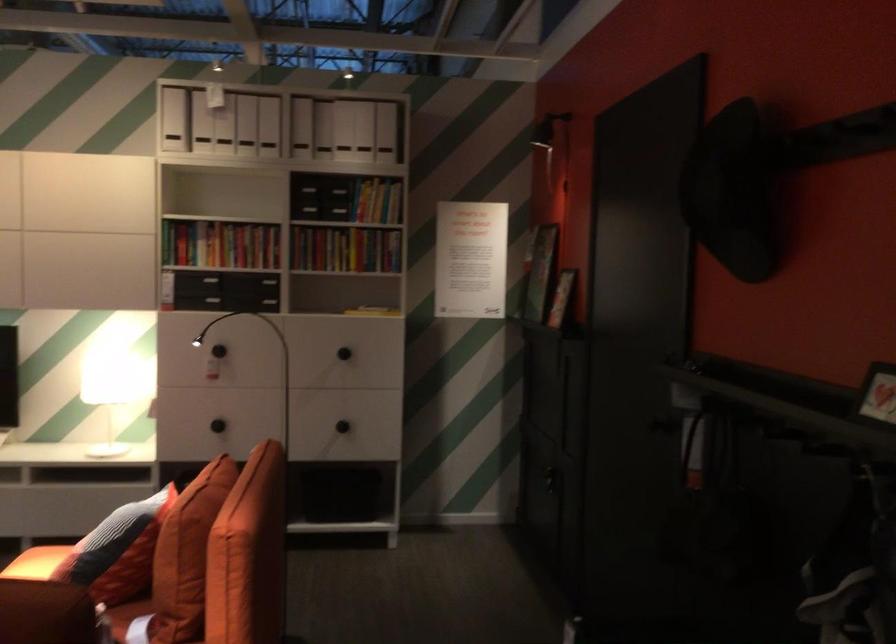
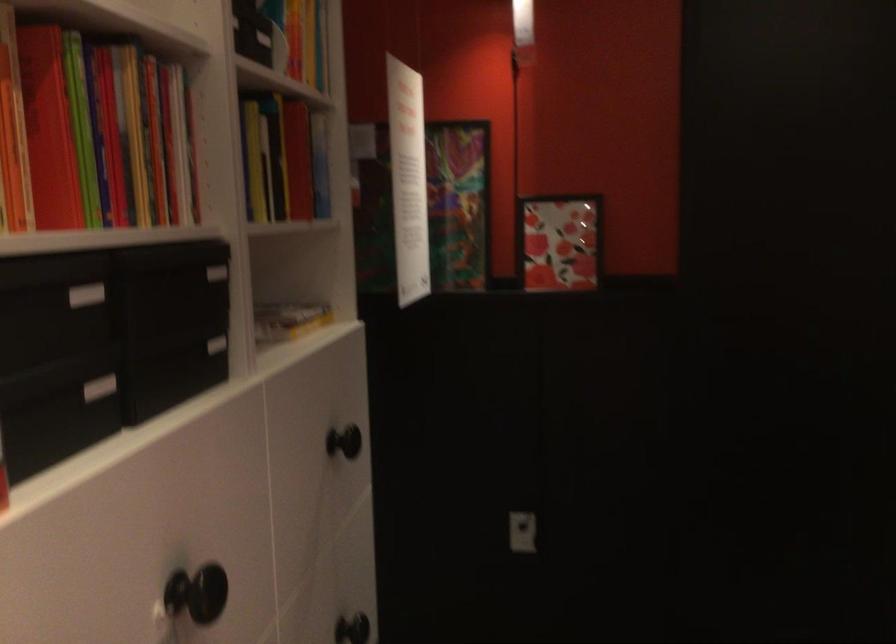
Locate, in the second image, the point that corresponds to point 224,234 in the first image.

(99, 136)